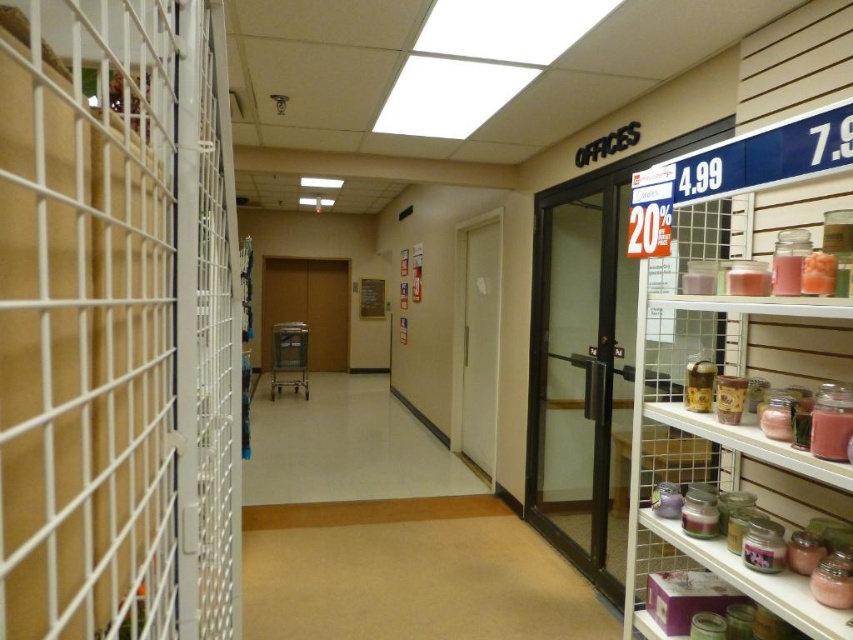
Question: Which of the following is the closest to the observer?

Choices:
 (A) pink glass jars at right
 (B) white wire mesh cage at left

Answer: (B)

Question: Is white wire mesh cage at left wider than pink glass jars at right?

Choices:
 (A) yes
 (B) no

Answer: (A)

Question: Can you confirm if white wire mesh cage at left is wider than pink glass jars at right?

Choices:
 (A) yes
 (B) no

Answer: (A)

Question: Does white wire mesh cage at left have a smaller size compared to pink glass jars at right?

Choices:
 (A) yes
 (B) no

Answer: (B)